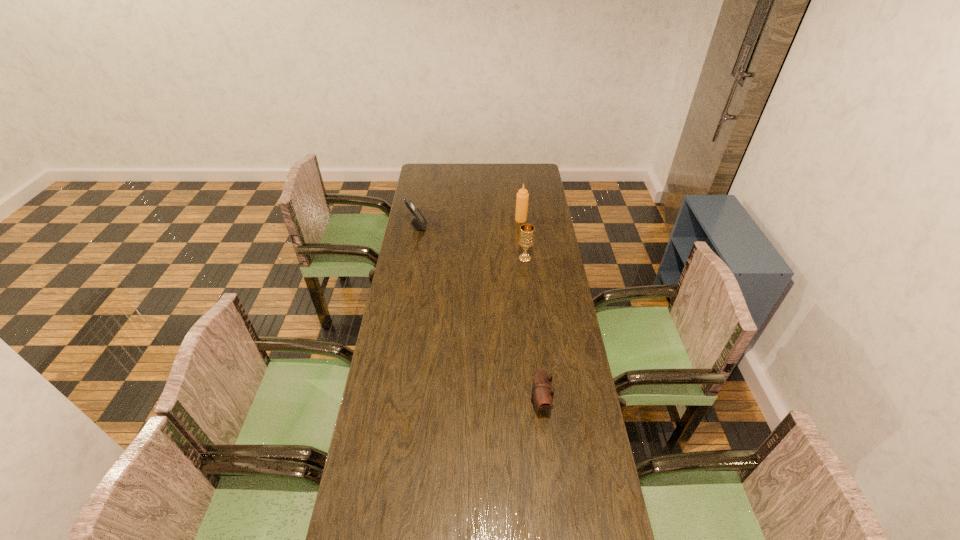
Locate an element on the screen. vacant position located with the flap open on the shortest object is located at coordinates pos(485,402).

Find the location of `object positioned at the left edge`. object positioned at the left edge is located at coordinates (418, 221).

Identify the location of condiment that is at the right edge. (522, 198).

Locate an element on the screen. The height and width of the screenshot is (540, 960). chalice present at the right edge is located at coordinates (526, 238).

Locate an element on the screen. pouch that is at the right edge is located at coordinates (542, 391).

Locate an element on the screen. blank space at the far edge of the desktop is located at coordinates (486, 174).

Where is `vacant space at the left edge`? This screenshot has width=960, height=540. vacant space at the left edge is located at coordinates (385, 345).

Image resolution: width=960 pixels, height=540 pixels. What are the coordinates of `vacant space at the right edge of the desktop` in the screenshot? It's located at (573, 327).

What are the coordinates of `vacant area between the chalice and the pouch` in the screenshot? It's located at (x=533, y=330).

Identify the location of free point between the cellular telephone and the nearest object. point(479,314).